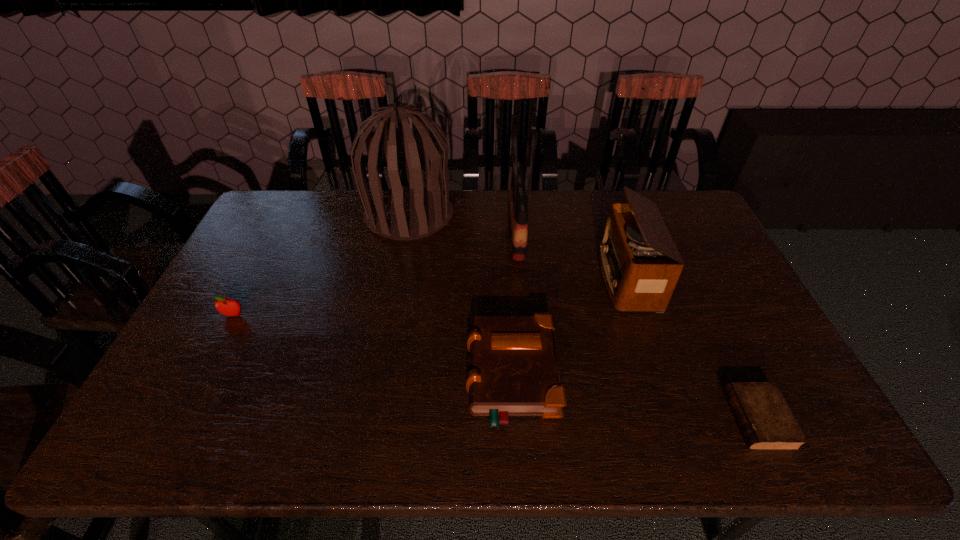
Locate an element on the screen. The image size is (960, 540). free location at the far left corner is located at coordinates (273, 211).

Locate an element on the screen. free space at the far right corner of the desktop is located at coordinates (699, 217).

At what (x,y) coordinates should I click in order to perform the action: click on free area in between the rightmost object and the Bible. Please return your answer as a coordinate pair (x, y). The height and width of the screenshot is (540, 960). Looking at the image, I should click on (635, 398).

Find the location of `empty space between the shopping bag and the birdcage`. empty space between the shopping bag and the birdcage is located at coordinates (463, 225).

Image resolution: width=960 pixels, height=540 pixels. I want to click on vacant space that's between the radio receiver and the apple, so click(x=430, y=297).

This screenshot has height=540, width=960. I want to click on vacant point located between the rightmost object and the radio receiver, so click(692, 349).

At what (x,y) coordinates should I click in order to perform the action: click on free space between the leftmost object and the fifth object from right to left. Please return your answer as a coordinate pair (x, y). This screenshot has width=960, height=540. Looking at the image, I should click on (322, 265).

This screenshot has width=960, height=540. I want to click on free space between the second object from left to right and the Bible, so click(461, 295).

At what (x,y) coordinates should I click in order to perform the action: click on free space that is in between the apple and the second object from right to left. Please return your answer as a coordinate pair (x, y). This screenshot has height=540, width=960. Looking at the image, I should click on (430, 297).

Identify the location of free space between the birdcage and the shopping bag. This screenshot has height=540, width=960. (463, 225).